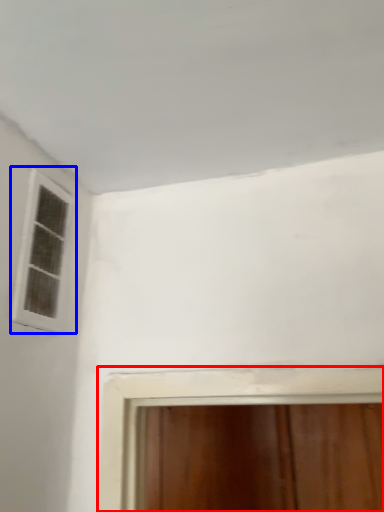
Question: Which object is closer to the camera taking this photo, window (highlighted by a red box) or window (highlighted by a blue box)?

Choices:
 (A) window
 (B) window

Answer: (B)